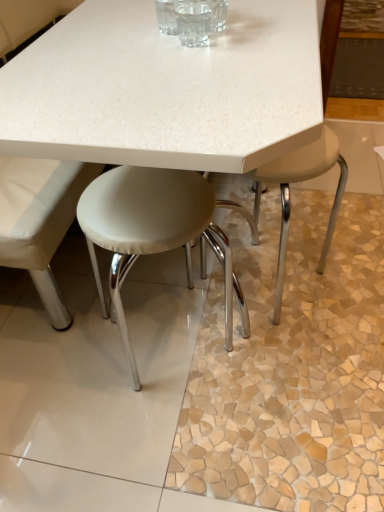
Identify the location of free spot to the left of beige leather stool at lower right, acting as the second stool starting from the left. The width and height of the screenshot is (384, 512). pyautogui.click(x=206, y=291).